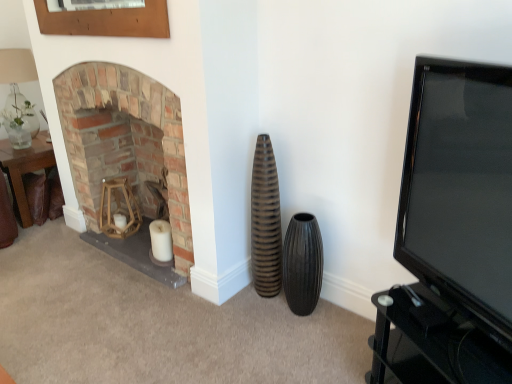
Question: Considering the relative sizes of brown leather table at left and brick fireplace at left in the image provided, is brown leather table at left bigger than brick fireplace at left?

Choices:
 (A) no
 (B) yes

Answer: (A)

Question: Are brown leather table at left and brick fireplace at left making contact?

Choices:
 (A) no
 (B) yes

Answer: (A)

Question: Is brown leather table at left positioned before brick fireplace at left?

Choices:
 (A) no
 (B) yes

Answer: (A)

Question: Can you confirm if brown leather table at left is shorter than brick fireplace at left?

Choices:
 (A) no
 (B) yes

Answer: (B)

Question: From the image's perspective, would you say brown leather table at left is positioned over brick fireplace at left?

Choices:
 (A) no
 (B) yes

Answer: (A)

Question: Considering the relative sizes of brown leather table at left and brick fireplace at left in the image provided, is brown leather table at left thinner than brick fireplace at left?

Choices:
 (A) yes
 (B) no

Answer: (B)

Question: Are brown ribbed vase at center, which is counted as the 2th vase, starting from the right, and wooden frame at upper left far apart?

Choices:
 (A) yes
 (B) no

Answer: (A)

Question: Is brown ribbed vase at center, which is counted as the 2th vase, starting from the right, facing away from wooden frame at upper left?

Choices:
 (A) no
 (B) yes

Answer: (A)

Question: Is brown ribbed vase at center, which is counted as the 2th vase, starting from the right, not within wooden frame at upper left?

Choices:
 (A) yes
 (B) no

Answer: (A)

Question: Could wooden frame at upper left be considered to be inside brown ribbed vase at center, which is the 1th vase from left to right?

Choices:
 (A) yes
 (B) no

Answer: (B)

Question: Considering the relative sizes of brown ribbed vase at center, which is the 1th vase from left to right, and wooden frame at upper left in the image provided, is brown ribbed vase at center, which is the 1th vase from left to right, thinner than wooden frame at upper left?

Choices:
 (A) yes
 (B) no

Answer: (B)

Question: Is brown ribbed vase at center, which is the 1th vase from left to right, closer to camera compared to wooden frame at upper left?

Choices:
 (A) yes
 (B) no

Answer: (B)

Question: Considering the relative sizes of translucent glass vase at upper left and wooden frame at upper left in the image provided, is translucent glass vase at upper left smaller than wooden frame at upper left?

Choices:
 (A) yes
 (B) no

Answer: (B)